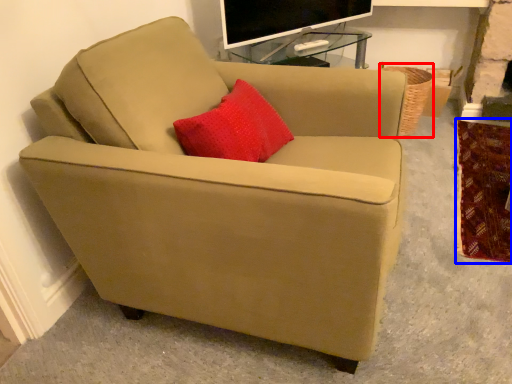
Question: Which object appears closest to the camera in this image, basket (highlighted by a red box) or blanket (highlighted by a blue box)?

Choices:
 (A) basket
 (B) blanket

Answer: (B)